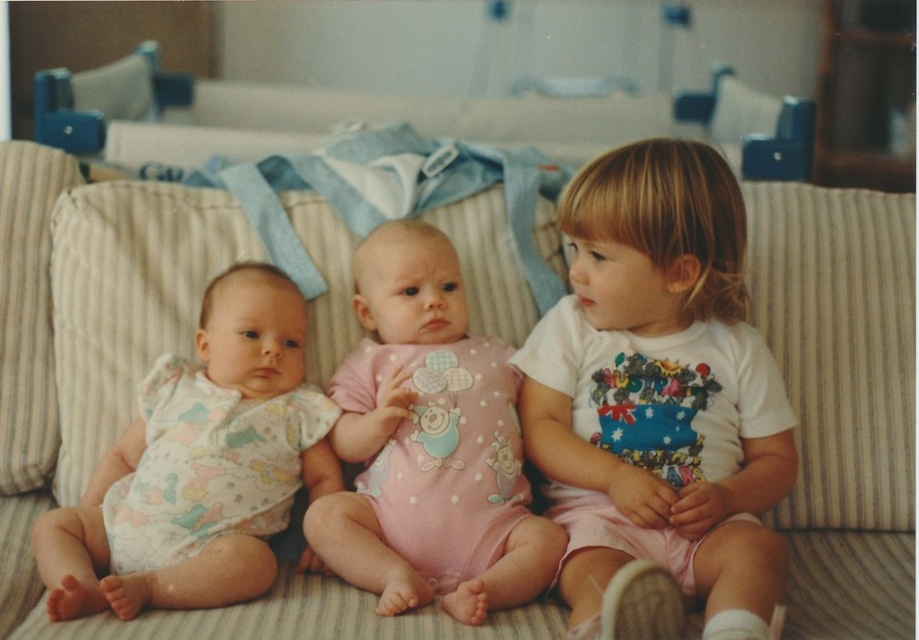
Who is more distant from viewer, [562,308] or [401,403]?

Point [562,308]

Who is more distant from viewer, (x=614, y=376) or (x=441, y=509)?

Point (x=614, y=376)

Where is `white cotton shirt at center`? white cotton shirt at center is located at coordinates point(657,401).

Is pink cotton onesie at center in front of blue fabric playpen at upper center?

Yes, pink cotton onesie at center is closer to the viewer.

The image size is (919, 640). What do you see at coordinates (428, 445) in the screenshot? I see `pink cotton onesie at center` at bounding box center [428, 445].

Locate an element on the screen. This screenshot has width=919, height=640. pink cotton onesie at center is located at coordinates (428, 445).

Can you confirm if white cotton shirt at center is positioned to the right of printed cotton onesie at left?

Yes, white cotton shirt at center is to the right of printed cotton onesie at left.

The height and width of the screenshot is (640, 919). What do you see at coordinates (657, 401) in the screenshot?
I see `white cotton shirt at center` at bounding box center [657, 401].

Is point (727, 552) more distant than point (101, 532)?

No, (727, 552) is in front of (101, 532).

Locate an element on the screen. white cotton shirt at center is located at coordinates point(657,401).